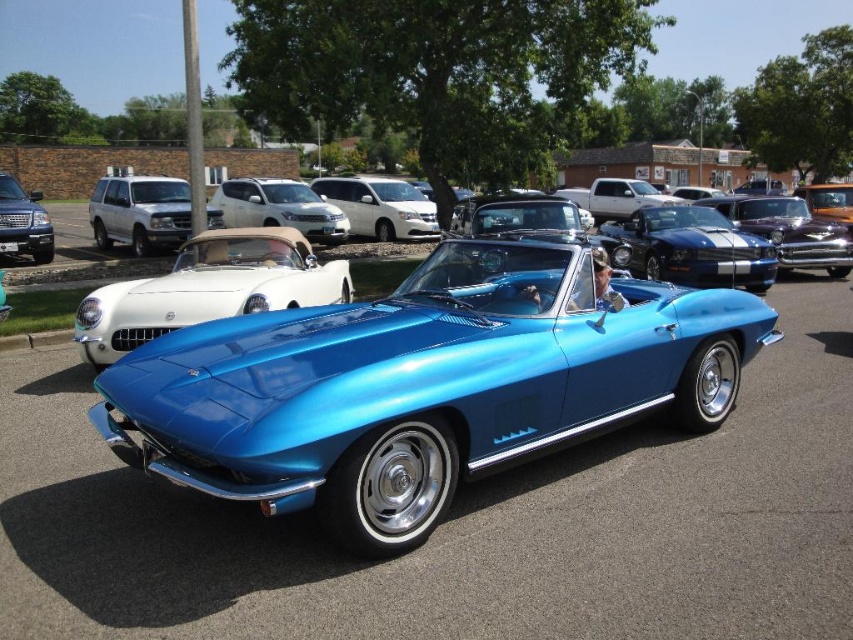
You are standing at the point labeled point [32,234] and want to see the point labeled point [756,243]. Can you see it directly without moving your position?

No, because point [756,243] is in front of point [32,234], so it would block the view.

You are a photographer wanting to capture both the shiny white convertible at center and the shiny blue convertible at center in a single frame. Based on their widths, which car should you position closer to the camera to ensure both fit in the shot?

The shiny white convertible at center might be wider than the shiny blue convertible at center, so positioning the wider shiny white convertible at center closer to the camera would help ensure both fit in the frame.

You are a parking attendant and need to move a car that is 4.5 meters long. You see the satin white minivan at center and the matte silver suv at left. Is there enough space between them to move the car through?

The distance between the satin white minivan at center and the matte silver suv at left is 9.10 meters. Since the car to move is 4.5 meters long, there is sufficient space to maneuver it through the gap.